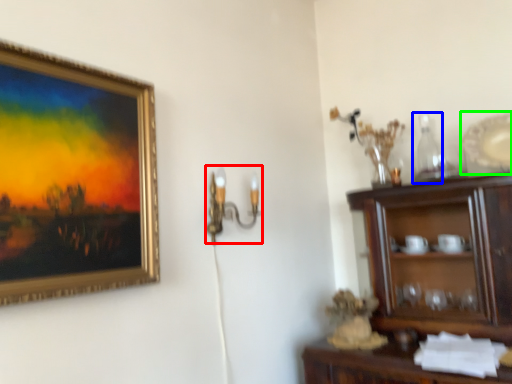
Question: Which object is the farthest from candle holder (highlighted by a red box)? Choose among these: bottle (highlighted by a blue box) or platter (highlighted by a green box).

Choices:
 (A) bottle
 (B) platter

Answer: (B)